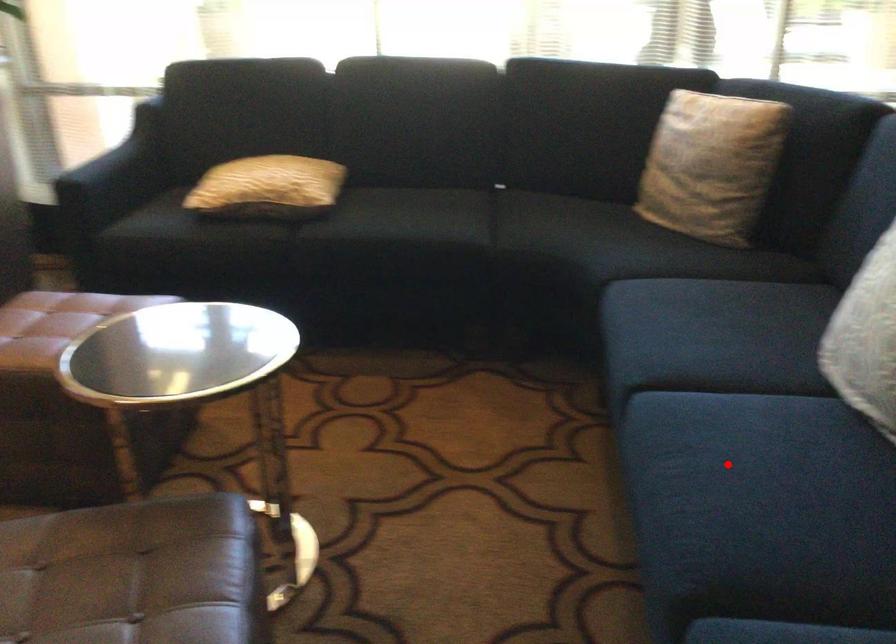
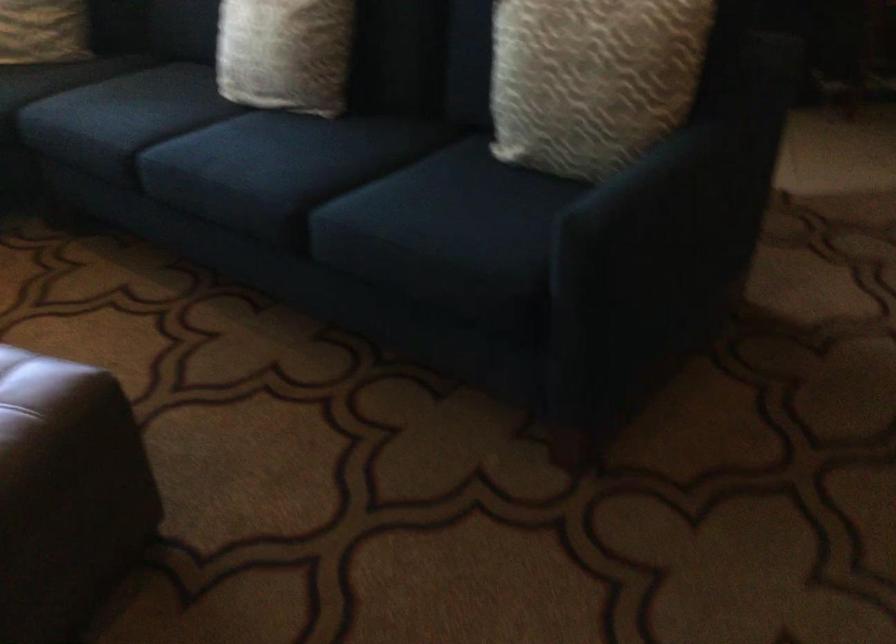
Where in the second image is the point corresponding to the highlighted location from the first image?

(245, 154)